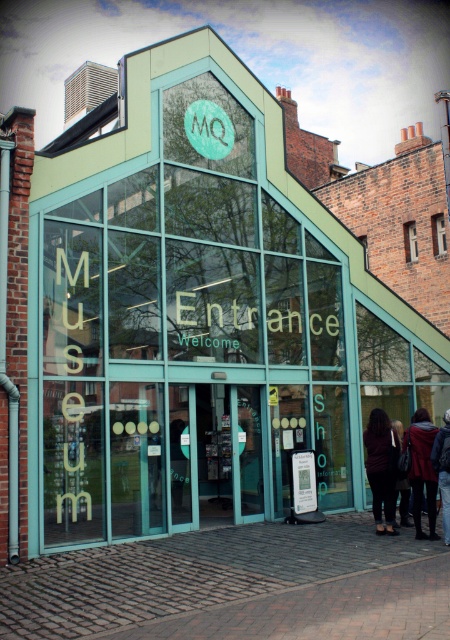
Question: Estimate the real-world distances between objects in this image. Which object is farther from the dark brown leather jacket at lower center?

Choices:
 (A) clear glass window at center
 (B) brick wall at upper center
 (C) dark brown leather jacket at center

Answer: (B)

Question: Among these objects, which one is farthest from the camera?

Choices:
 (A) clear glass window at center
 (B) dark brown leather jacket at lower center
 (C) brick wall at upper center

Answer: (C)

Question: From the image, what is the correct spatial relationship of dark brown leather jacket at lower center in relation to dark blue jacket at lower right?

Choices:
 (A) below
 (B) above

Answer: (A)

Question: Which point is farther to the camera?

Choices:
 (A) dark blue jacket at lower right
 (B) dark brown leather jacket at center
 (C) brick wall at upper center
 (D) dark brown leather jacket at lower center

Answer: (C)

Question: Does dark brown leather jacket at lower center appear on the left side of brick wall at upper center?

Choices:
 (A) no
 (B) yes

Answer: (B)

Question: Is dark brown leather jacket at lower center bigger than dark brown leather jacket at center?

Choices:
 (A) no
 (B) yes

Answer: (A)